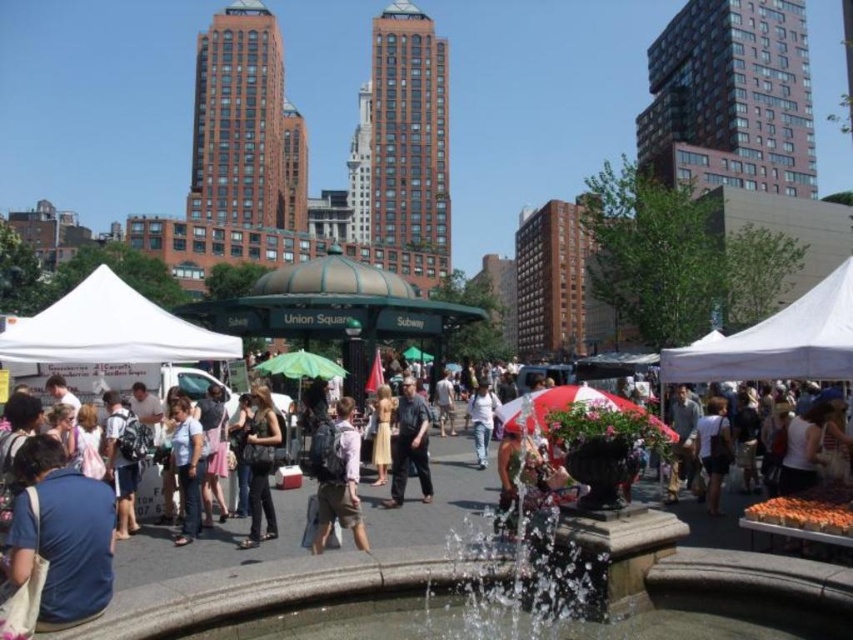
Who is higher up, dark gray shirt at center or light blue shirt at center?

Positioned higher is light blue shirt at center.

Describe the element at coordinates (410, 444) in the screenshot. The width and height of the screenshot is (853, 640). I see `dark gray shirt at center` at that location.

From the picture: Who is more forward, (399,461) or (195,509)?

Positioned in front is point (195,509).

The width and height of the screenshot is (853, 640). Identify the location of dark gray shirt at center. (410, 444).

Is matte blue shirt at lower left bigger than white cotton shirt at center?

Incorrect, matte blue shirt at lower left is not larger than white cotton shirt at center.

Is matte blue shirt at lower left thinner than white cotton shirt at center?

Correct, matte blue shirt at lower left's width is less than white cotton shirt at center's.

You are a GUI agent. You are given a task and a screenshot of the screen. Output one action in this format:
    pyautogui.click(x=<x>, y=<y>)
    Task: Click on the matte blue shirt at lower left
    
    Given the screenshot: What is the action you would take?
    pyautogui.click(x=61, y=534)

This screenshot has height=640, width=853. What are the coordinates of `matte blue shirt at lower left` in the screenshot? It's located at (61, 534).

Who is more distant from viewer, (38, 528) or (428, 426)?

Positioned behind is point (428, 426).

The height and width of the screenshot is (640, 853). I want to click on matte blue shirt at lower left, so click(61, 534).

This screenshot has height=640, width=853. I want to click on matte blue shirt at lower left, so click(61, 534).